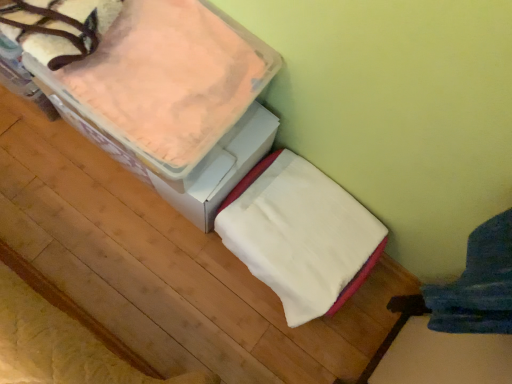
Where is `vacant area that lies in front of white soft blanket at center`? The width and height of the screenshot is (512, 384). vacant area that lies in front of white soft blanket at center is located at coordinates (243, 340).